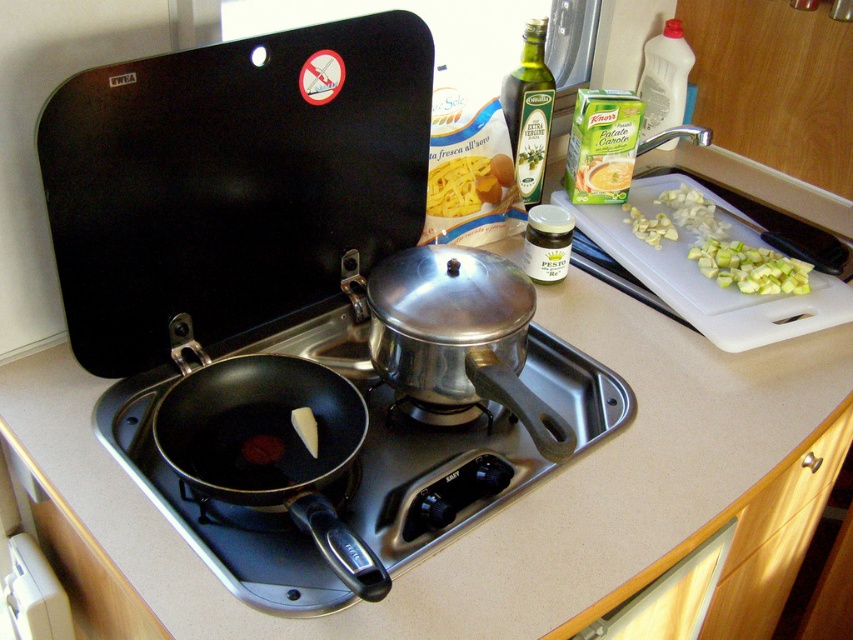
You are preparing a meal in this kitchen and need to move the white plastic cutting board at upper right to the counter space next to the black matte pan at lower left. Can you do this without moving the pan?

The black matte pan at lower left is below the white plastic cutting board at upper right, so moving the cutting board to the side of the pan should be possible as they are positioned vertically apart. However, ensure there is enough horizontal counter space next to the pan to place the cutting board.

You are preparing a meal in this kitchen and need to determine which item is bigger between the black matte pan at lower left and the white plastic cutting board at upper right. Can you tell me which one is larger?

The black matte pan at lower left is larger in size than the white plastic cutting board at upper right.

You are preparing a meal and need to store both the matte black frying pan at lower left and the white plastic cutting board at upper right in a drawer. The drawer has a height limit of 10 cm. Which item might not fit if the frying pan is 8 cm thick and the cutting board is 12 cm thick?

The white plastic cutting board at upper right might not fit in the drawer since it is 12 cm thick, exceeding the 10 cm height limit, while the matte black frying pan at lower left is only 8 cm thick and would fit.